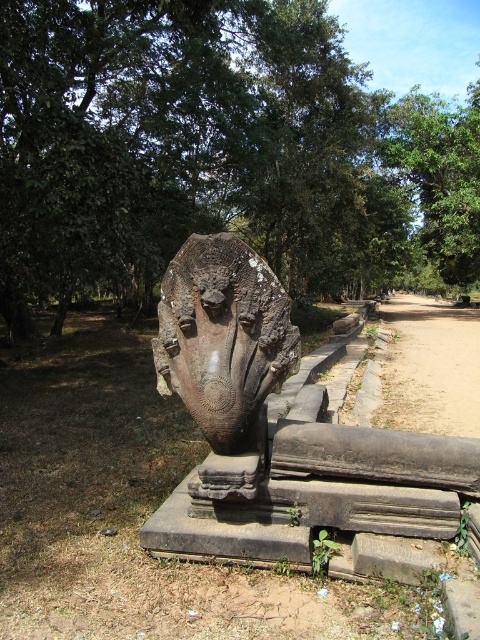
Is point (191, 362) closer to viewer compared to point (444, 189)?

Yes.

You are a GUI agent. You are given a task and a screenshot of the screen. Output one action in this format:
    pyautogui.click(x=<x>, y=<y>)
    Task: Click on the rusty stone statue at center
    
    Given the screenshot: What is the action you would take?
    pyautogui.click(x=279, y=428)

Which is behind, point (214, 300) or point (424, 120)?

The point (424, 120) is more distant.

Locate an element on the screen. This screenshot has height=640, width=480. rusty stone statue at center is located at coordinates (279, 428).

Is point (215, 259) farther from viewer compared to point (200, 246)?

No, it is in front of (200, 246).

Does rusty stone statue at center have a smaller size compared to rusty stone face at center?

Incorrect, rusty stone statue at center is not smaller in size than rusty stone face at center.

Who is more distant from viewer, (220, 490) or (263, 328)?

Positioned behind is point (263, 328).

Locate an element on the screen. rusty stone statue at center is located at coordinates (279, 428).

Between rusty stone face at center and green leafy tree at upper center, which one has less height?

Standing shorter between the two is rusty stone face at center.

Measure the distance between rusty stone face at center and camera.

rusty stone face at center is 2.49 meters from camera.

Identify the location of rusty stone face at center. (223, 337).